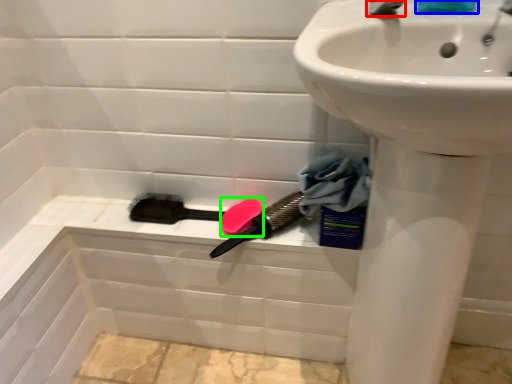
Question: Which object is positioned farthest from tap (highlighted by a red box)? Select from liquid (highlighted by a blue box) and soap (highlighted by a green box).

Choices:
 (A) liquid
 (B) soap

Answer: (B)